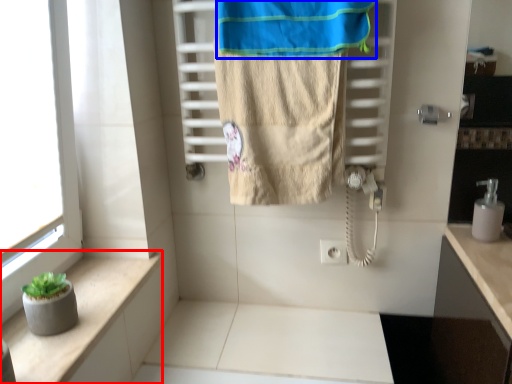
Question: Which object is closer to the camera taking this photo, balustrade (highlighted by a red box) or beach towel (highlighted by a blue box)?

Choices:
 (A) balustrade
 (B) beach towel

Answer: (A)